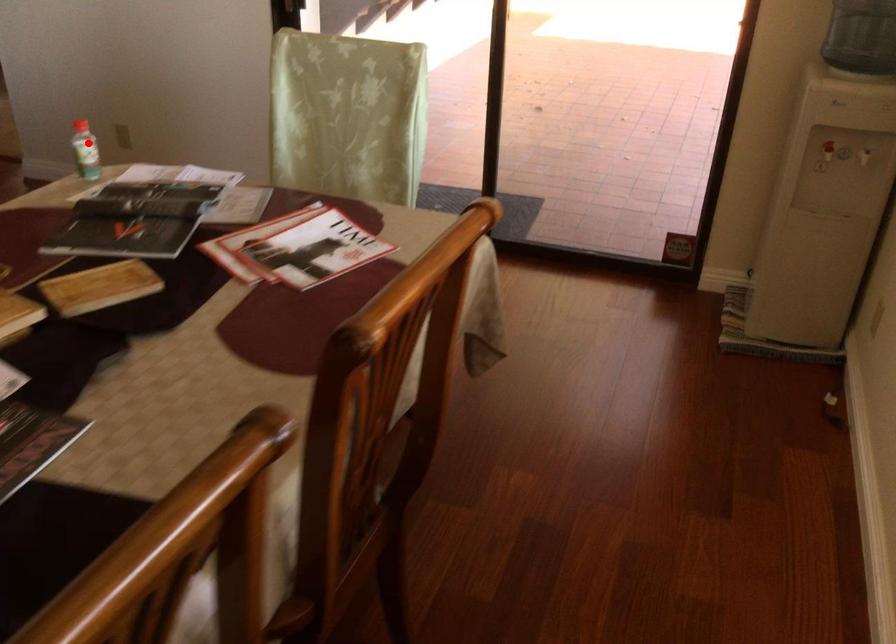
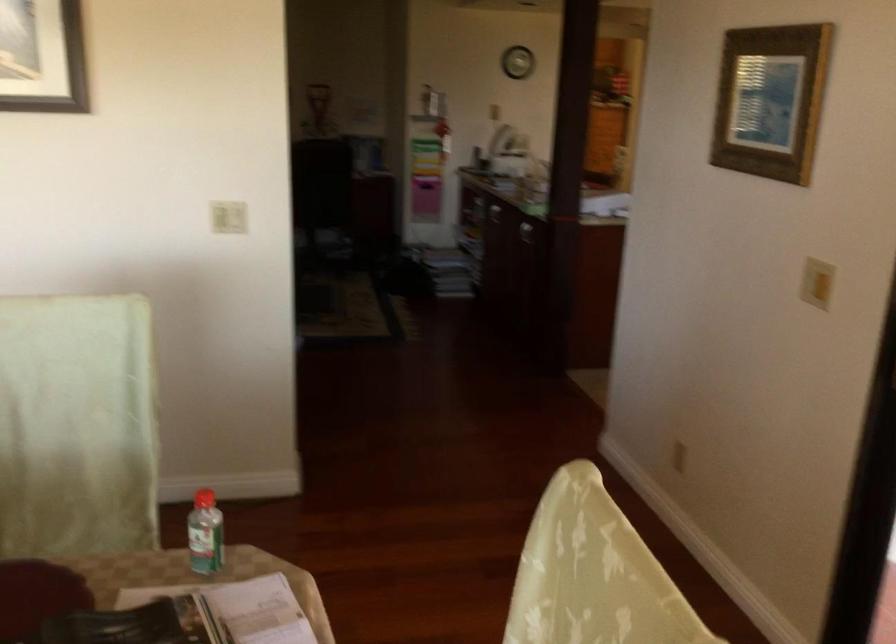
Question: I am providing you with two images of the same scene from different viewpoints. Given a red point in image1, look at the same physical point in image2. Is it:

Choices:
 (A) Closer to the viewpoint
 (B) Farther from the viewpoint

Answer: (A)